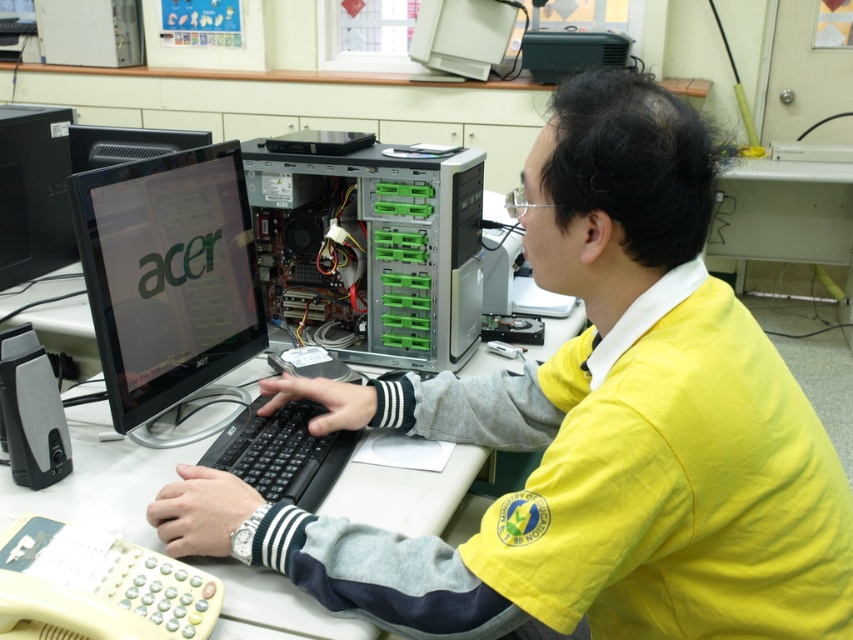
Question: Which point is closer to the camera?

Choices:
 (A) coord(270,444)
 (B) coord(680,288)

Answer: (B)

Question: Which point appears closest to the camera in this image?

Choices:
 (A) [289, 497]
 (B) [413, 364]
 (C) [498, 563]

Answer: (C)

Question: Which is nearer to the matte black monitor at left?

Choices:
 (A) black plastic keyboard at center
 (B) satin black monitor at center
 (C) beige plastic telephone at lower left

Answer: (B)

Question: Is satin black monitor at center below beige plastic telephone at lower left?

Choices:
 (A) yes
 (B) no

Answer: (B)

Question: Is the position of satin black monitor at center more distant than that of black plastic keyboard at center?

Choices:
 (A) yes
 (B) no

Answer: (B)

Question: Considering the relative positions of yellow fabric shirt at center and matte black monitor at left in the image provided, where is yellow fabric shirt at center located with respect to matte black monitor at left?

Choices:
 (A) above
 (B) below

Answer: (B)